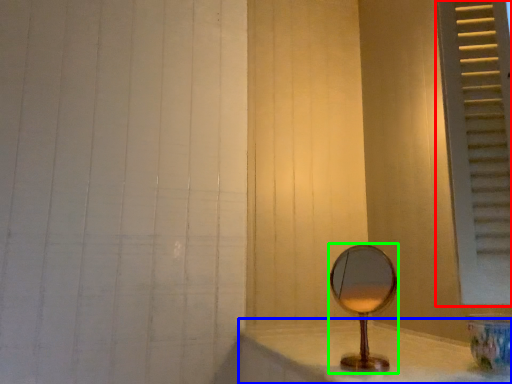
Question: Which object is the farthest from window frame (highlighted by a red box)? Choose among these: counter top (highlighted by a blue box) or mirror (highlighted by a green box).

Choices:
 (A) counter top
 (B) mirror

Answer: (A)